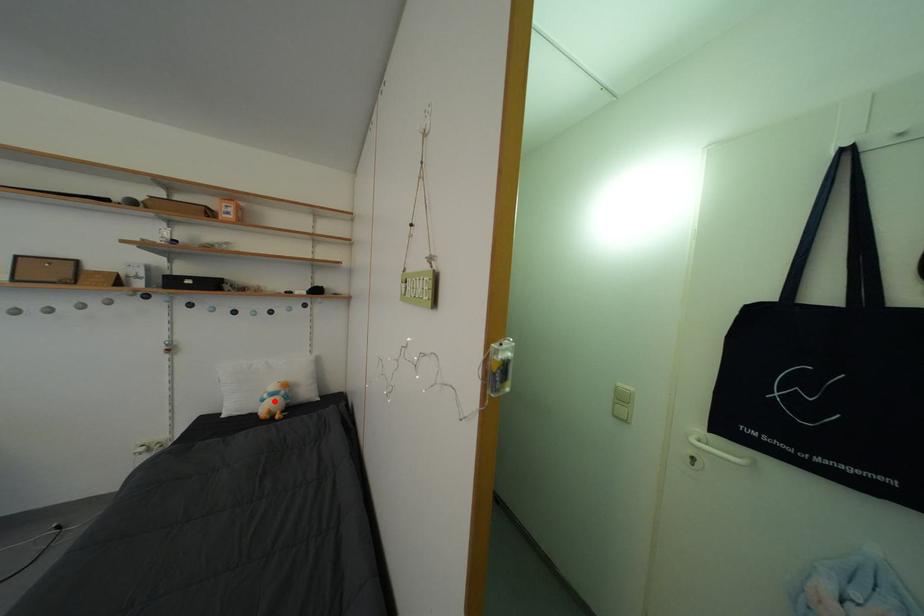
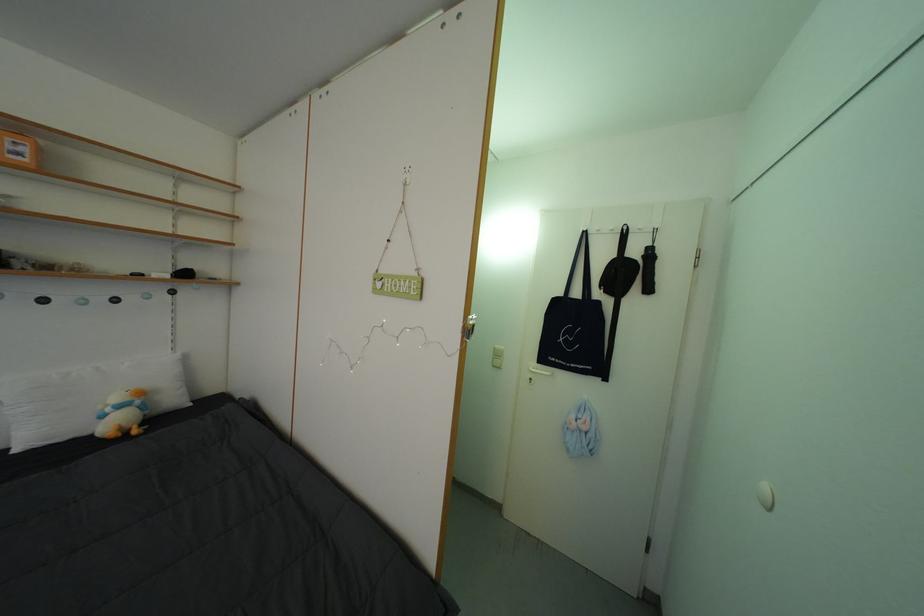
Find the pixel in the second image that matches the highlighted location in the first image.

(117, 415)